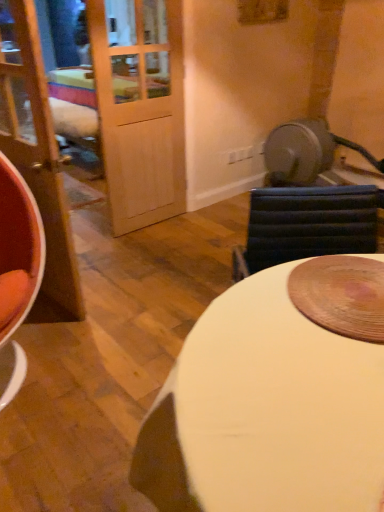
Question: From a real-world perspective, is matte wood door at left physically located above or below white glossy table at center?

Choices:
 (A) above
 (B) below

Answer: (A)

Question: From the image's perspective, is matte wood door at left located above or below white glossy table at center?

Choices:
 (A) below
 (B) above

Answer: (B)

Question: Considering the positions of matte wood door at left and white glossy table at center in the image, is matte wood door at left bigger or smaller than white glossy table at center?

Choices:
 (A) small
 (B) big

Answer: (A)

Question: From the image's perspective, is white glossy table at center located above or below matte wood door at left?

Choices:
 (A) above
 (B) below

Answer: (B)

Question: From a real-world perspective, relative to matte wood door at left, is white glossy table at center vertically above or below?

Choices:
 (A) below
 (B) above

Answer: (A)

Question: In terms of height, does white glossy table at center look taller or shorter compared to matte wood door at left?

Choices:
 (A) tall
 (B) short

Answer: (B)

Question: Is white glossy table at center bigger or smaller than matte wood door at left?

Choices:
 (A) small
 (B) big

Answer: (B)